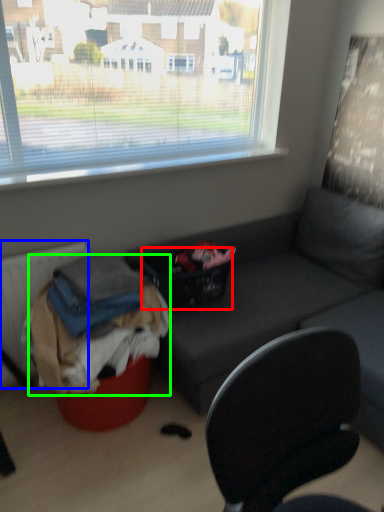
Question: Which object is positioned closest to basket (highlighted by a red box)? Select from radiator (highlighted by a blue box) and clothing (highlighted by a green box).

Choices:
 (A) radiator
 (B) clothing

Answer: (B)